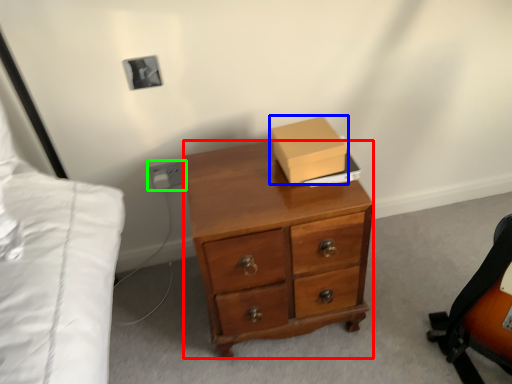
Question: Estimate the real-world distances between objects in this image. Which object is closer to desk (highlighted by a red box), box (highlighted by a blue box) or electric outlet (highlighted by a green box)?

Choices:
 (A) box
 (B) electric outlet

Answer: (A)